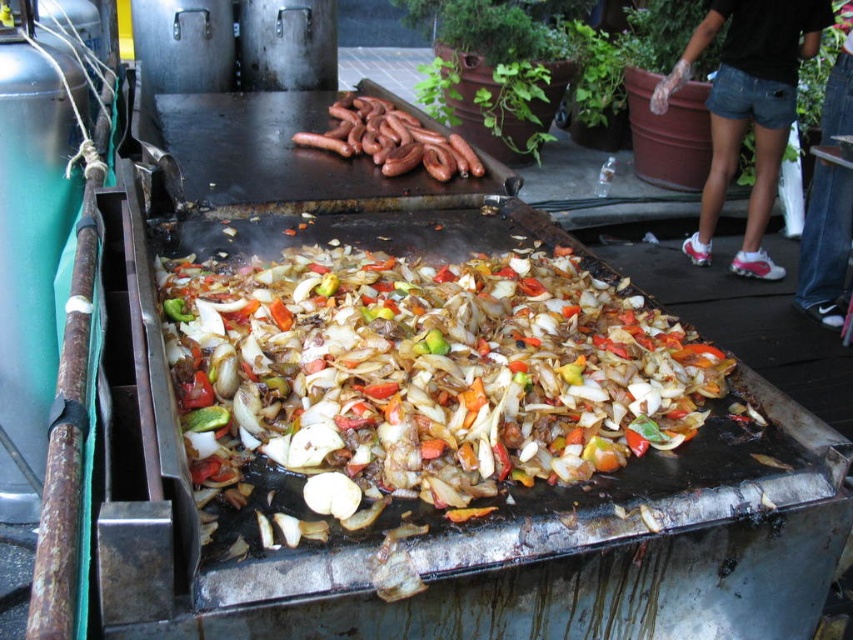
In the scene shown: You are a food vendor at the market and need to place two new ingredients on the grill. The first ingredient must be placed at point [375,392] and the second at point [316,145]. Which point is closer to you when you are standing in front of the grill?

Point [375,392] is closer to the viewer than point [316,145], so the first ingredient placed at point [375,392] will be closer to you.

You are a food vendor at the market and need to check the cooking progress of your dishes. Which of the items on the grill, the slightly browned vegetables at center or the brown glossy sausages at center, requires more space due to its size?

The slightly browned vegetables at center requires more space because it is larger in size than the brown glossy sausages at center.

You are a food critic standing at the edge of the cooking area. You want to take a photo of the slightly browned vegetables at center from directly above. Is the grill surface flat enough to ensure the vegetables remain in place while you take the photo?

The slightly browned vegetables at center are located at point (422, 372) on the grill surface. Since the grill is described as flat, the vegetables should remain in place while taking the photo.